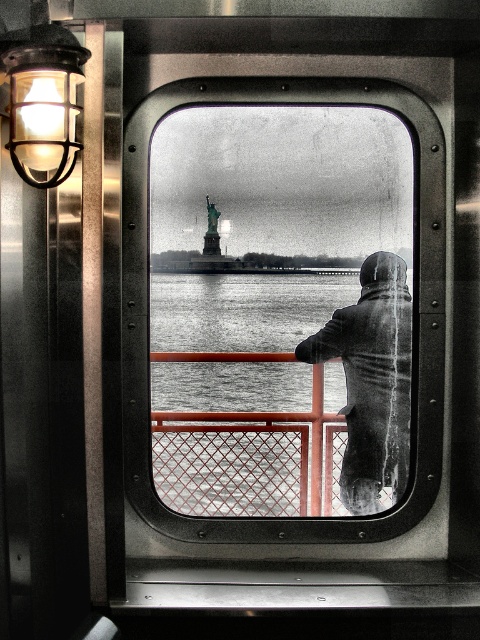
You are on a ferry and want to take a photo of the gray woolen coat at center through the metallic glass window at center. Can you see the entire coat in the window frame?

The metallic glass window at center is located above gray woolen coat at center, so the window frame is positioned higher than the coat. This means the lower part of the coat might be cut off by the window frame, making it impossible to capture the entire coat in the photo.

You are on a ferry and want to take a photo of the gray woolen coat at center and the matte black light fixture at upper left through the window. Which object should you point your camera at first if you want to capture both in one shot?

You should point your camera at the matte black light fixture at upper left first because the gray woolen coat at center is located below it, ensuring both are in the frame when centered on the upper object.

You are on a ferry and want to take a photo of the Statue of Liberty through the window. However, there is a light fixture blocking your view. Which object is above the other, the metallic glass window at center or the matte black light fixture at upper left?

The matte black light fixture at upper left is above the metallic glass window at center, so it is blocking the view.